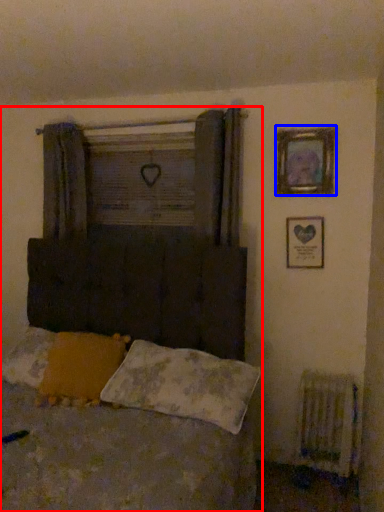
Question: Which object is closer to the camera taking this photo, bed (highlighted by a red box) or picture frame (highlighted by a blue box)?

Choices:
 (A) bed
 (B) picture frame

Answer: (A)